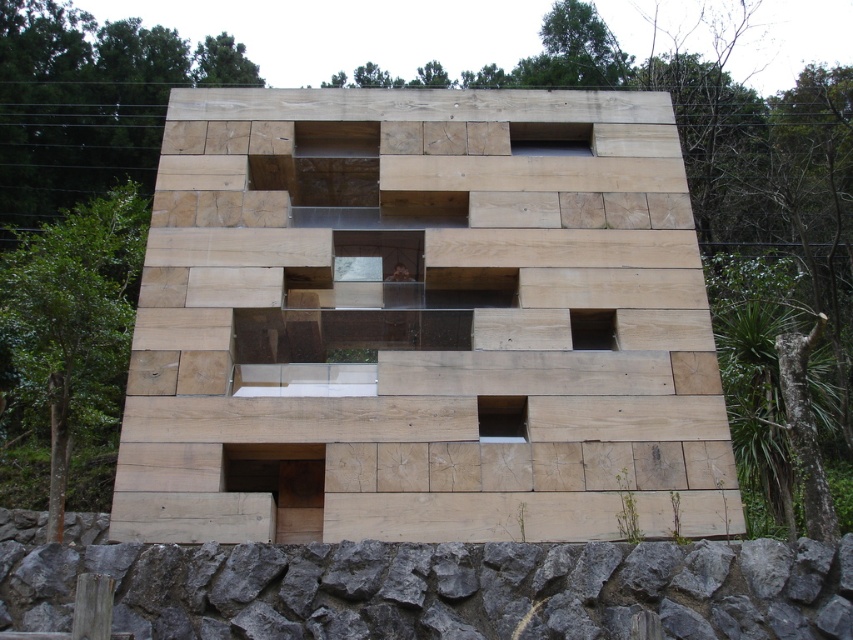
Does natural wood plywood at center have a larger size compared to gray rough stone at lower center?

Yes.

Does point (654, 372) come farther from viewer compared to point (171, 632)?

Yes, point (654, 372) is behind point (171, 632).

What are the coordinates of `natural wood plywood at center` in the screenshot? It's located at tap(422, 323).